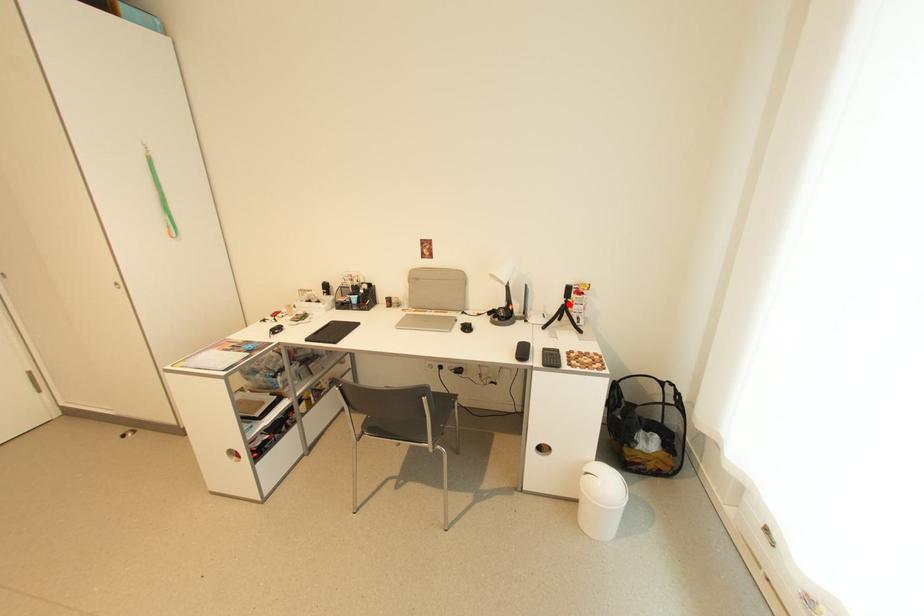
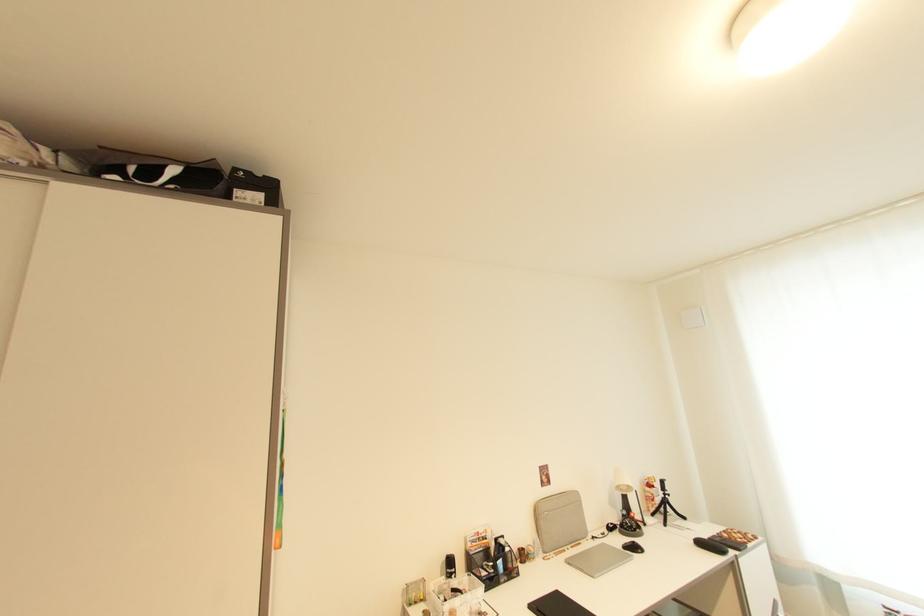
Question: I am providing you with two images of the same scene from different viewpoints. Given a red point in image1, look at the same physical point in image2. Is it:

Choices:
 (A) Closer to the viewpoint
 (B) Farther from the viewpoint

Answer: (B)